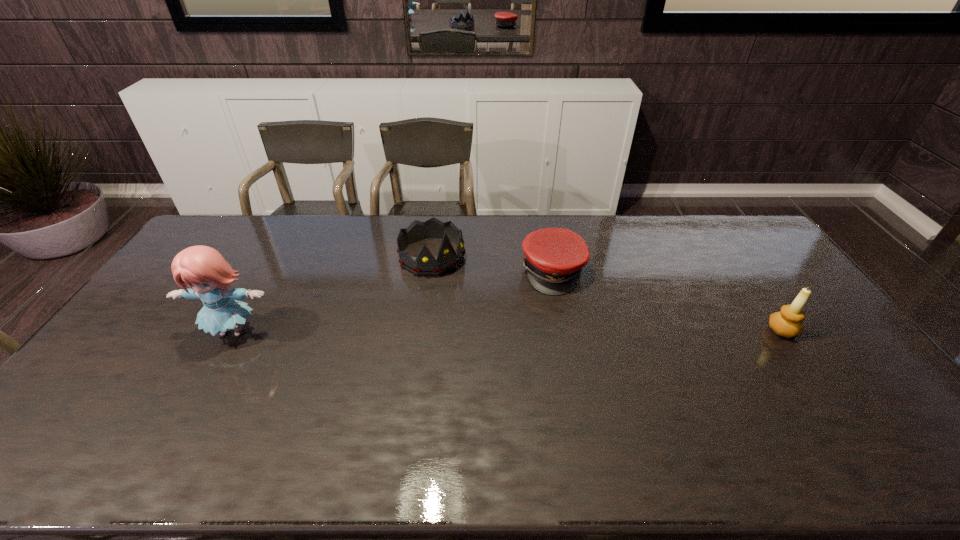
Locate an element on the screen. The image size is (960, 540). doll is located at coordinates (202, 268).

Locate an element on the screen. Image resolution: width=960 pixels, height=540 pixels. the tallest object is located at coordinates (202, 268).

Where is `candle_holder`? candle_holder is located at coordinates (787, 322).

Find the location of a particular element. Image resolution: width=960 pixels, height=540 pixels. the second object from left to right is located at coordinates [425, 264].

Locate an element on the screen. This screenshot has width=960, height=540. the shortest object is located at coordinates [555, 257].

You are a GUI agent. You are given a task and a screenshot of the screen. Output one action in this format:
    pyautogui.click(x=<x>, y=<y>)
    Task: Click on the second object from right to left
    The height and width of the screenshot is (540, 960).
    Given the screenshot: What is the action you would take?
    pyautogui.click(x=555, y=257)

You are a GUI agent. You are given a task and a screenshot of the screen. Output one action in this format:
    pyautogui.click(x=<x>, y=<y>)
    Task: Click on the blank space located on the front-facing side of the tallest object
    This screenshot has width=960, height=540.
    Given the screenshot: What is the action you would take?
    pyautogui.click(x=205, y=381)

Identify the location of free space located 0.150m on the back of the candle_holder. The width and height of the screenshot is (960, 540). (752, 286).

The width and height of the screenshot is (960, 540). Find the location of `vacant space situated at the front of the third object from right to left with jewels`. vacant space situated at the front of the third object from right to left with jewels is located at coordinates (471, 298).

Where is `vacant space located 0.380m at the front of the third object from right to left with jewels`? The image size is (960, 540). vacant space located 0.380m at the front of the third object from right to left with jewels is located at coordinates (517, 346).